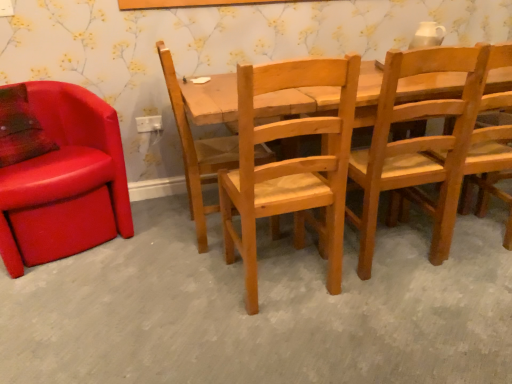
At what (x,y) coordinates should I click in order to perform the action: click on vacant region under light brown wood chair at right, arranged as the fifth chair when viewed from the left (from a real-world perspective). Please return your answer as a coordinate pair (x, y). This screenshot has height=384, width=512. Looking at the image, I should click on (469, 234).